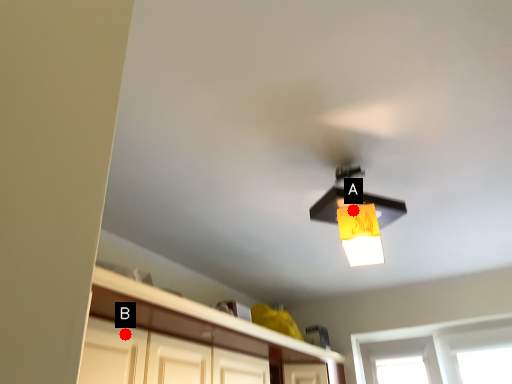
Question: Two points are circled on the image, labeled by A and B beside each circle. Which point is closer to the camera?

Choices:
 (A) A is closer
 (B) B is closer

Answer: (A)